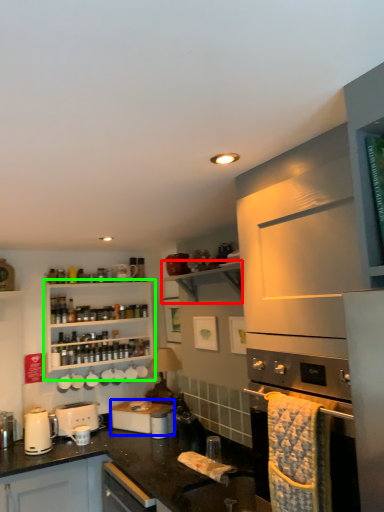
Question: Which object is the closest to the shelf (highlighted by a red box)? Choose among these: appliance (highlighted by a blue box) or cabinetry (highlighted by a green box).

Choices:
 (A) appliance
 (B) cabinetry

Answer: (B)